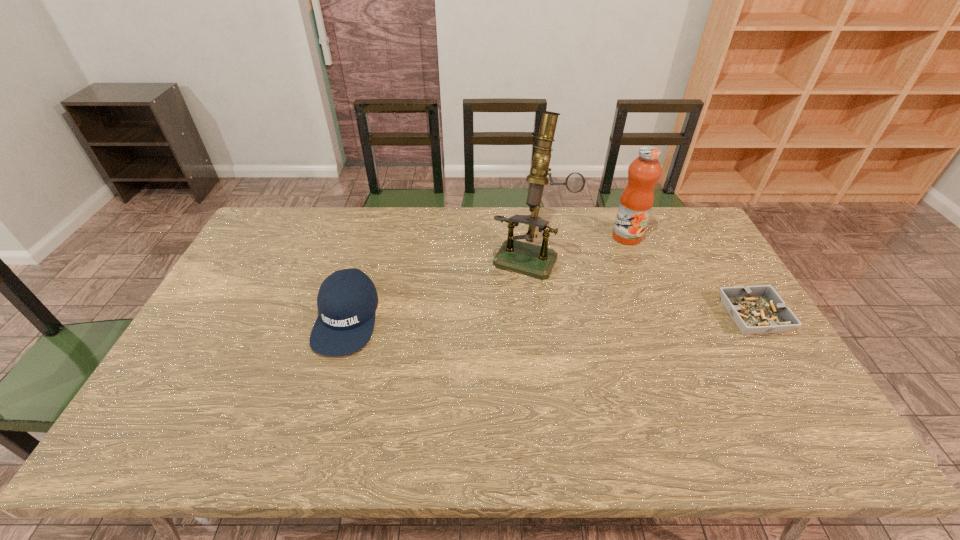
In order to click on free space on the desktop that is between the third tallest object and the rightmost object and is positioned on the front label of the second tallest object in this screenshot , I will do `click(585, 317)`.

The height and width of the screenshot is (540, 960). Identify the location of free space on the desktop that is between the baseball cap and the shortest object and is positioned at the eyepiece of the third object from right to left. (500, 318).